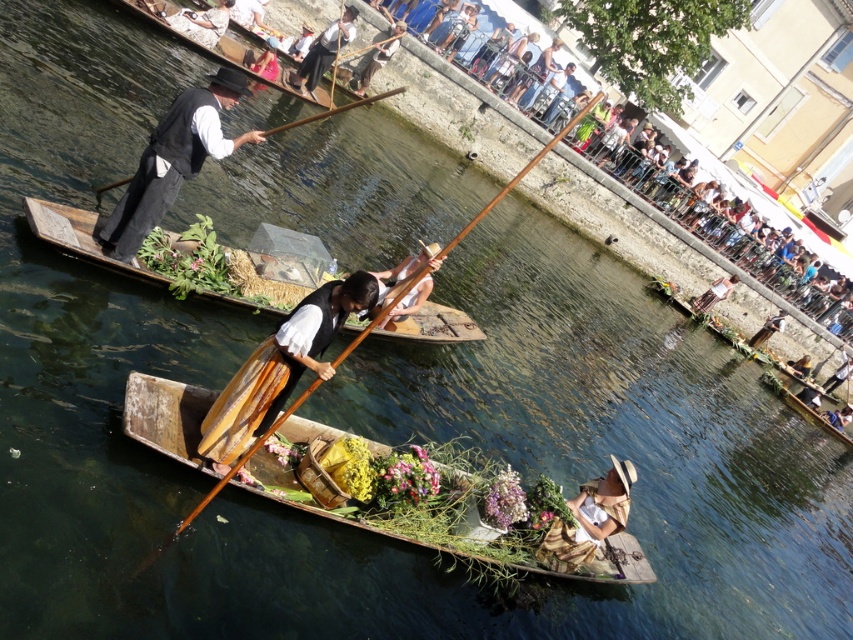
You are organizing a boat race and need to ensure all boats are the same size. You have two boats available for the race, the wooden boat at center and the wooden at left. Which boat should you choose to replace the smaller one to ensure uniformity?

The wooden boat at center is smaller than the wooden at left, so you should replace the wooden boat at center with the larger wooden at left to ensure all boats are the same size.

From the picture: You are an observer on the canal bank and notice the matte black vest at upper left and the wooden canoe at center. Which object appears bigger in the scene?

The matte black vest at upper left appears larger than the wooden canoe at center in the scene.